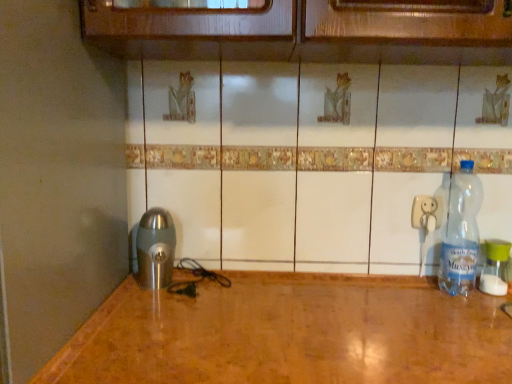
Question: Is brushed metal coffee grinder at lower left placed right next to white plastic electric outlet at right?

Choices:
 (A) no
 (B) yes

Answer: (A)

Question: Does brushed metal coffee grinder at lower left appear on the right side of white plastic electric outlet at right?

Choices:
 (A) yes
 (B) no

Answer: (B)

Question: Is brushed metal coffee grinder at lower left turned away from white plastic electric outlet at right?

Choices:
 (A) no
 (B) yes

Answer: (A)

Question: From the image's perspective, would you say brushed metal coffee grinder at lower left is shown under white plastic electric outlet at right?

Choices:
 (A) no
 (B) yes

Answer: (B)

Question: Would you say brushed metal coffee grinder at lower left contains white plastic electric outlet at right?

Choices:
 (A) no
 (B) yes

Answer: (A)

Question: Is white plastic electric outlet at right to the left or to the right of clear plastic bottle at right, the first bottle positioned from the right, in the image?

Choices:
 (A) left
 (B) right

Answer: (A)

Question: Choose the correct answer: Is white plastic electric outlet at right inside clear plastic bottle at right, the first bottle positioned from the right, or outside it?

Choices:
 (A) outside
 (B) inside

Answer: (A)

Question: From a real-world perspective, is white plastic electric outlet at right above or below clear plastic bottle at right, which is the 2th bottle from left to right?

Choices:
 (A) above
 (B) below

Answer: (A)

Question: In terms of width, does white plastic electric outlet at right look wider or thinner when compared to clear plastic bottle at right, the first bottle positioned from the right?

Choices:
 (A) thin
 (B) wide

Answer: (A)

Question: From their relative heights in the image, would you say transparent plastic bottle at right, the 1th bottle when ordered from left to right, is taller or shorter than clear plastic bottle at right, which is the 2th bottle from left to right?

Choices:
 (A) tall
 (B) short

Answer: (A)

Question: Looking at their shapes, would you say transparent plastic bottle at right, the 1th bottle when ordered from left to right, is wider or thinner than clear plastic bottle at right, the first bottle positioned from the right?

Choices:
 (A) wide
 (B) thin

Answer: (A)

Question: In terms of size, does transparent plastic bottle at right, the second bottle from the right, appear bigger or smaller than clear plastic bottle at right, the first bottle positioned from the right?

Choices:
 (A) big
 (B) small

Answer: (A)

Question: Is transparent plastic bottle at right, the 1th bottle when ordered from left to right, spatially inside clear plastic bottle at right, the first bottle positioned from the right, or outside of it?

Choices:
 (A) outside
 (B) inside

Answer: (A)

Question: In terms of height, does clear plastic bottle at right, the first bottle positioned from the right, look taller or shorter compared to white plastic electric outlet at right?

Choices:
 (A) tall
 (B) short

Answer: (A)

Question: Looking at their shapes, would you say clear plastic bottle at right, which is the 2th bottle from left to right, is wider or thinner than white plastic electric outlet at right?

Choices:
 (A) wide
 (B) thin

Answer: (A)